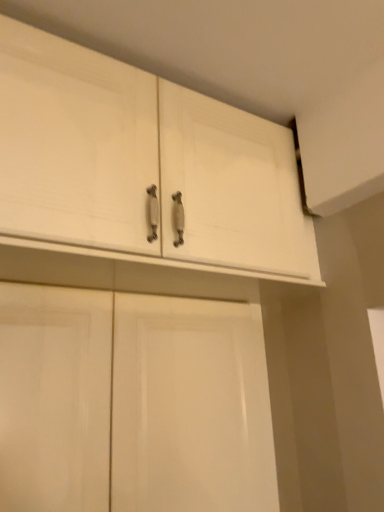
Question: In which direction should I rotate to look at white wood cabinet at upper center, the 1th cabinetry in the top-to-bottom sequence?

Choices:
 (A) right
 (B) left

Answer: (B)

Question: Is the position of white matte cabinet doors at lower center, arranged as the 1th cabinetry when ordered from the bottom, more distant than that of white wood cabinet at upper center, placed as the 2th cabinetry when sorted from bottom to top?

Choices:
 (A) no
 (B) yes

Answer: (B)

Question: Is white wood cabinet at upper center, the 1th cabinetry in the top-to-bottom sequence, inside white matte cabinet doors at lower center, the second cabinetry when ordered from top to bottom?

Choices:
 (A) no
 (B) yes

Answer: (A)

Question: Is white matte cabinet doors at lower center, arranged as the 1th cabinetry when ordered from the bottom, positioned in front of white wood cabinet at upper center, the 1th cabinetry in the top-to-bottom sequence?

Choices:
 (A) yes
 (B) no

Answer: (B)

Question: From a real-world perspective, is white matte cabinet doors at lower center, arranged as the 1th cabinetry when ordered from the bottom, over white wood cabinet at upper center, the 1th cabinetry in the top-to-bottom sequence?

Choices:
 (A) no
 (B) yes

Answer: (A)

Question: Is white matte cabinet doors at lower center, the second cabinetry when ordered from top to bottom, outside white wood cabinet at upper center, the 1th cabinetry in the top-to-bottom sequence?

Choices:
 (A) no
 (B) yes

Answer: (B)

Question: Does white matte cabinet doors at lower center, the second cabinetry when ordered from top to bottom, have a lesser height compared to white wood cabinet at upper center, placed as the 2th cabinetry when sorted from bottom to top?

Choices:
 (A) yes
 (B) no

Answer: (B)

Question: Is white wood cabinet at upper center, the 1th cabinetry in the top-to-bottom sequence, aimed at white matte cabinet doors at lower center, the second cabinetry when ordered from top to bottom?

Choices:
 (A) yes
 (B) no

Answer: (B)

Question: Would you say white wood cabinet at upper center, the 1th cabinetry in the top-to-bottom sequence, is a long distance from white matte cabinet doors at lower center, arranged as the 1th cabinetry when ordered from the bottom?

Choices:
 (A) no
 (B) yes

Answer: (A)

Question: From a real-world perspective, is white wood cabinet at upper center, placed as the 2th cabinetry when sorted from bottom to top, beneath white matte cabinet doors at lower center, arranged as the 1th cabinetry when ordered from the bottom?

Choices:
 (A) yes
 (B) no

Answer: (B)

Question: From the image's perspective, is white wood cabinet at upper center, the 1th cabinetry in the top-to-bottom sequence, below white matte cabinet doors at lower center, arranged as the 1th cabinetry when ordered from the bottom?

Choices:
 (A) no
 (B) yes

Answer: (A)

Question: Is white wood cabinet at upper center, the 1th cabinetry in the top-to-bottom sequence, located outside white matte cabinet doors at lower center, the second cabinetry when ordered from top to bottom?

Choices:
 (A) yes
 (B) no

Answer: (A)

Question: Does white wood cabinet at upper center, placed as the 2th cabinetry when sorted from bottom to top, appear on the left side of white matte cabinet doors at lower center, the second cabinetry when ordered from top to bottom?

Choices:
 (A) no
 (B) yes

Answer: (A)

Question: From the image's perspective, relative to white matte cabinet doors at lower center, arranged as the 1th cabinetry when ordered from the bottom, is white wood cabinet at upper center, the 1th cabinetry in the top-to-bottom sequence, above or below?

Choices:
 (A) above
 (B) below

Answer: (A)